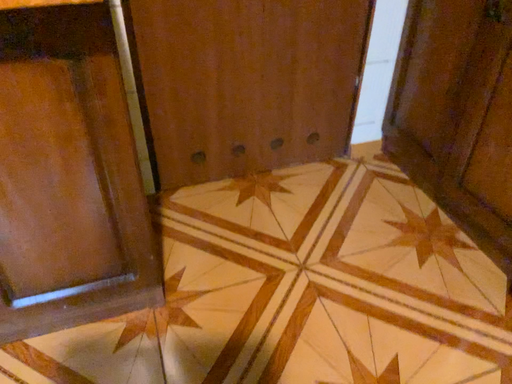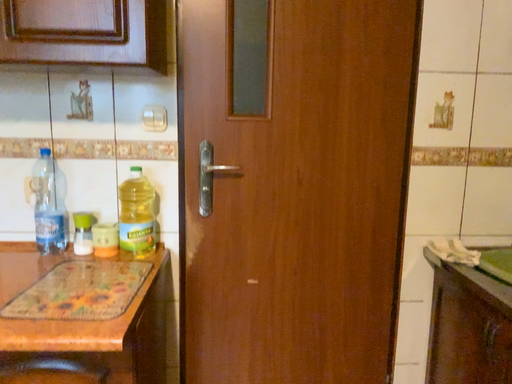
Question: Which way did the camera rotate in the video?

Choices:
 (A) rotated right
 (B) rotated left

Answer: (B)